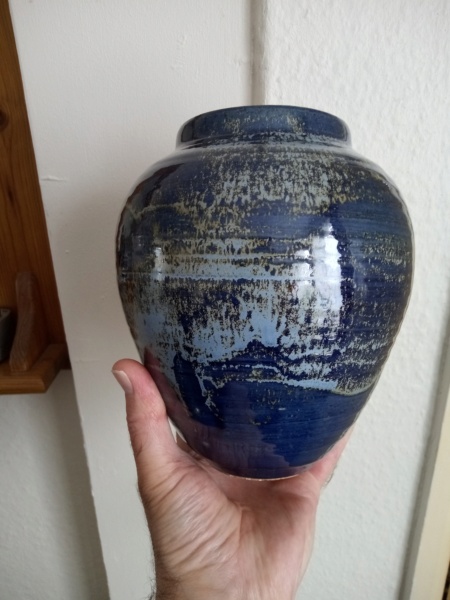
This screenshot has height=600, width=450. Identify the location of reflection on vase. (244, 414).